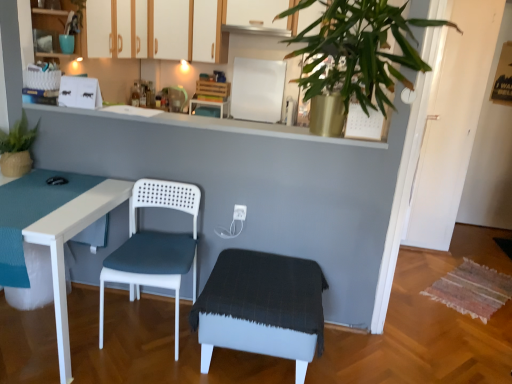
Locate an element on the screen. This screenshot has width=512, height=384. vacant location below white plastic chair at center (from a real-world perspective) is located at coordinates (150, 332).